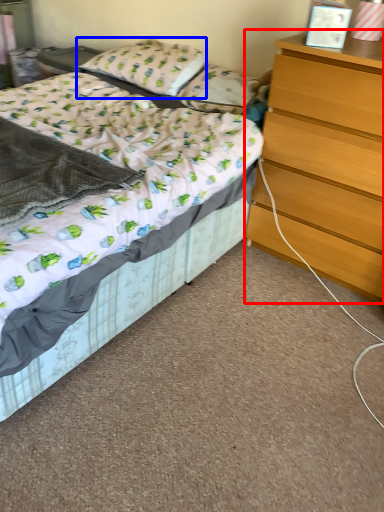
Question: Which point is closer to the camera, chest of drawers (highlighted by a red box) or pillow (highlighted by a blue box)?

Choices:
 (A) chest of drawers
 (B) pillow

Answer: (A)